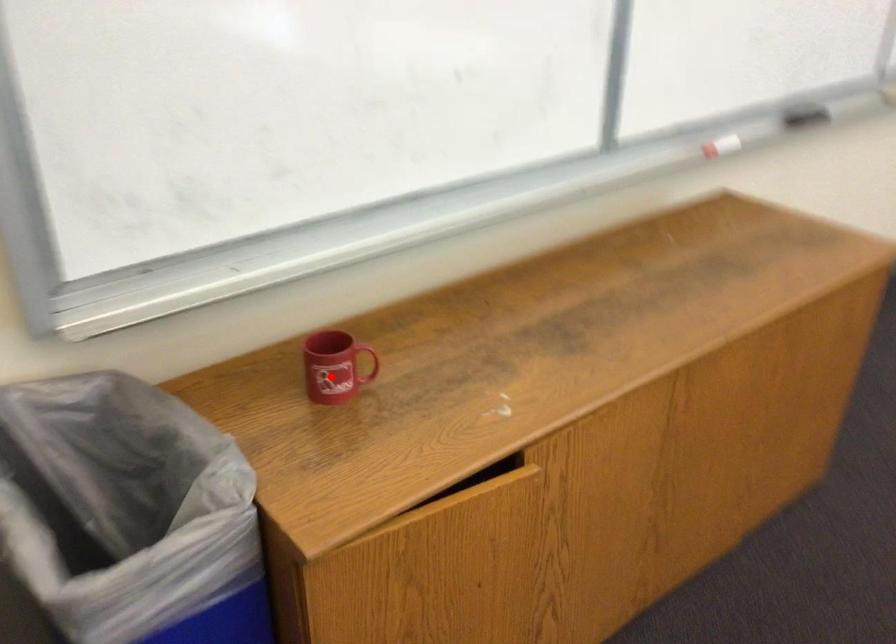
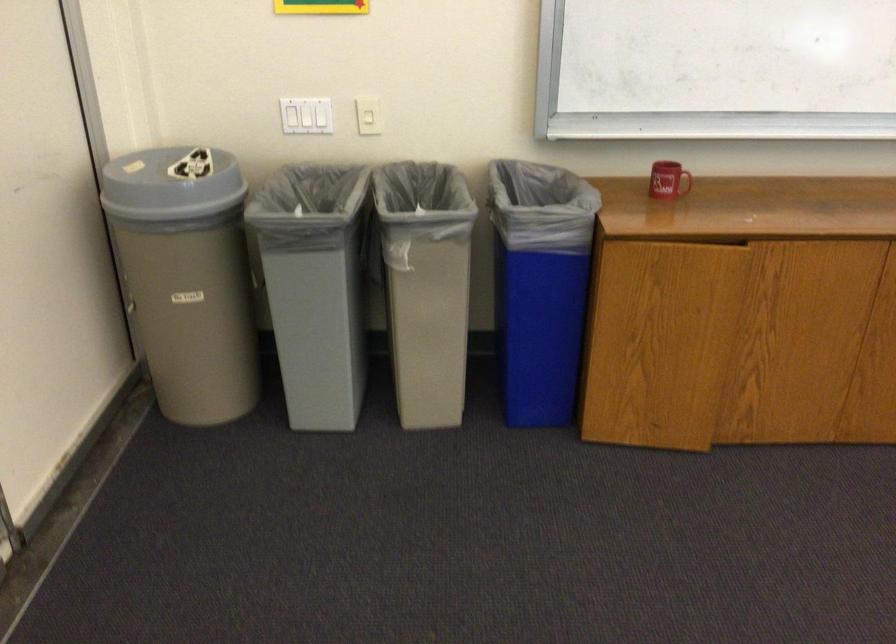
Find the pixel in the second image that matches the highlighted location in the first image.

(664, 180)